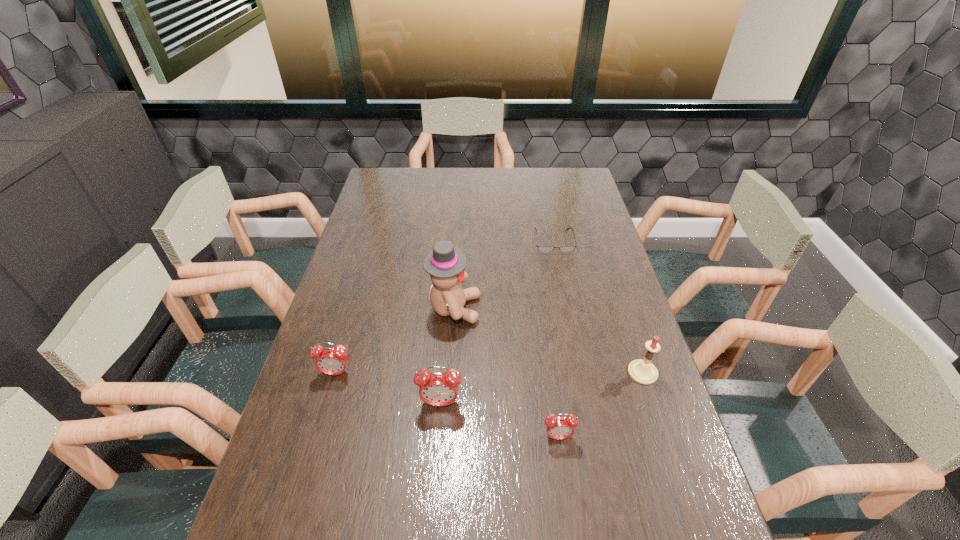
At what (x,y) coordinates should I click in order to perform the action: click on vacant area between the rightmost alarm clock and the second shortest alarm clock. Please return your answer as a coordinate pair (x, y). Looking at the image, I should click on (447, 405).

Where is `free space between the farthest object and the nearest object`? This screenshot has width=960, height=540. free space between the farthest object and the nearest object is located at coordinates (556, 339).

This screenshot has width=960, height=540. In order to click on free space between the farthest object and the second nearest object in this screenshot , I will do click(497, 322).

Identify the location of free space between the nearest alarm clock and the second alarm clock from left to right. (499, 420).

In order to click on vacant area that lies between the second shortest alarm clock and the second farthest object in this screenshot , I will do `click(395, 341)`.

You are a GUI agent. You are given a task and a screenshot of the screen. Output one action in this format:
    pyautogui.click(x=<x>, y=<y>)
    Task: Click on the unoccupied area between the spectacles and the rightmost object
    The image size is (960, 540).
    Given the screenshot: What is the action you would take?
    pyautogui.click(x=598, y=307)

Identify the location of object that stands as the closest to the rightmost object. (560, 427).

Point out which object is positioned as the second nearest to the second shortest alarm clock. Please provide its 2D coordinates. Your answer should be formatted as a tuple, i.e. [(x, y)], where the tuple contains the x and y coordinates of a point satisfying the conditions above.

[(445, 263)]

At what (x,y) coordinates should I click in order to perform the action: click on alarm clock that is the third closest to the rag_doll. Please return your answer as a coordinate pair (x, y). Looking at the image, I should click on (560, 427).

Identify which alarm clock is the second nearest to the fifth nearest object. Please provide its 2D coordinates. Your answer should be formatted as a tuple, i.e. [(x, y)], where the tuple contains the x and y coordinates of a point satisfying the conditions above.

[(332, 361)]